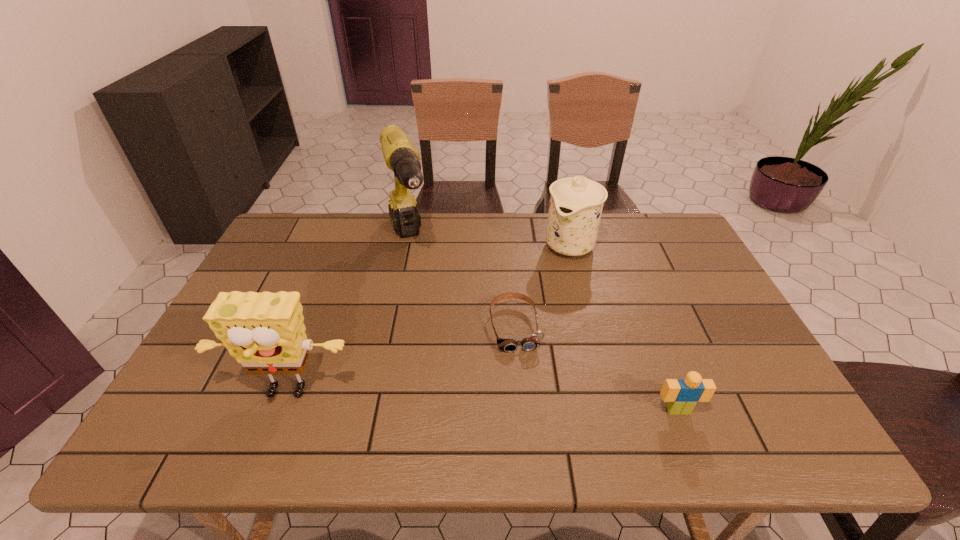
The height and width of the screenshot is (540, 960). What are the coordinates of `free space located 0.370m on the spout of the chinaware` in the screenshot? It's located at (501, 341).

Where is `blank space located on the spout of the chinaware`? This screenshot has width=960, height=540. blank space located on the spout of the chinaware is located at coordinates (497, 346).

The height and width of the screenshot is (540, 960). Find the location of `blank area located 0.080m on the handle side of the drill`. blank area located 0.080m on the handle side of the drill is located at coordinates (418, 290).

This screenshot has width=960, height=540. What are the coordinates of `free location located on the handle side of the drill` in the screenshot? It's located at (441, 355).

Locate an element on the screen. This screenshot has width=960, height=540. free spot located on the handle side of the drill is located at coordinates (447, 373).

I want to click on chinaware situated at the far edge, so [576, 203].

Identify the location of drill positioned at the far edge. (401, 156).

Find the location of `sponge that is at the near edge`. sponge that is at the near edge is located at coordinates (265, 332).

Locate an element on the screen. The width and height of the screenshot is (960, 540). Lego that is positioned at the near edge is located at coordinates (682, 395).

Locate an element on the screen. object positioned at the left edge is located at coordinates (265, 332).